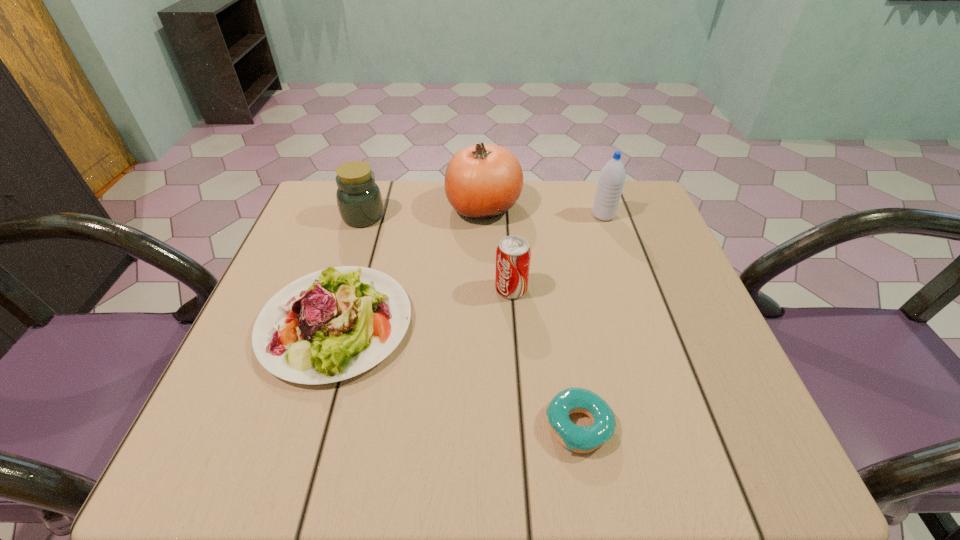
Identify the location of vacant point located between the rightmost object and the nearest object. This screenshot has height=540, width=960. [x=591, y=321].

Where is `vacant region between the soda can and the salad plate`? The height and width of the screenshot is (540, 960). vacant region between the soda can and the salad plate is located at coordinates (423, 307).

Where is `vacant space in between the jar and the pumpkin`? The image size is (960, 540). vacant space in between the jar and the pumpkin is located at coordinates (423, 211).

Find the location of a particular element. blank region between the jar and the soda can is located at coordinates (437, 253).

Find the location of a particular element. Image resolution: width=960 pixels, height=540 pixels. free space between the water bottle and the second shortest object is located at coordinates (469, 269).

The width and height of the screenshot is (960, 540). I want to click on free spot between the pumpkin and the fifth tallest object, so (410, 265).

Where is `object that ranks as the second closest to the jar`? object that ranks as the second closest to the jar is located at coordinates (482, 181).

Identify which object is the nearest to the doughnut. Please provide its 2D coordinates. Your answer should be formatted as a tuple, i.e. [(x, y)], where the tuple contains the x and y coordinates of a point satisfying the conditions above.

[(513, 253)]

Where is `free location that satisfies the following two spatial constraints: 1. on the front side of the soda can; 2. on the right side of the jar`? This screenshot has width=960, height=540. free location that satisfies the following two spatial constraints: 1. on the front side of the soda can; 2. on the right side of the jar is located at coordinates (340, 289).

Identify the location of free space that satisfies the following two spatial constraints: 1. on the back side of the soda can; 2. on the left side of the water bottle. This screenshot has height=540, width=960. (506, 215).